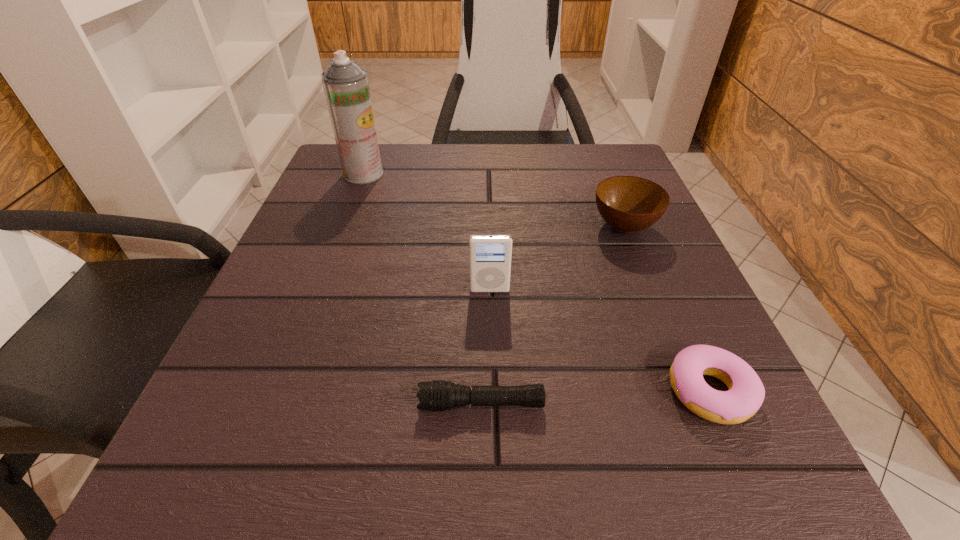
Where is `aerosol can`? This screenshot has width=960, height=540. aerosol can is located at coordinates (346, 87).

Identify the location of the farthest object. The image size is (960, 540). (346, 87).

Where is `iPod`? iPod is located at coordinates (490, 256).

Where is `the third farthest object`? the third farthest object is located at coordinates tap(490, 256).

Where is `the fourth nearest object`? the fourth nearest object is located at coordinates (628, 204).

The width and height of the screenshot is (960, 540). I want to click on the third tallest object, so click(628, 204).

What are the coordinates of `doughnut` in the screenshot? It's located at (745, 395).

Where is `flashlight`? This screenshot has height=540, width=960. flashlight is located at coordinates (437, 395).

The image size is (960, 540). I want to click on free space located 0.280m on the front of the farthest object, so click(x=326, y=273).

Locate an element on the screen. This screenshot has width=960, height=540. vacant space located 0.210m on the front-facing side of the second tallest object is located at coordinates (492, 413).